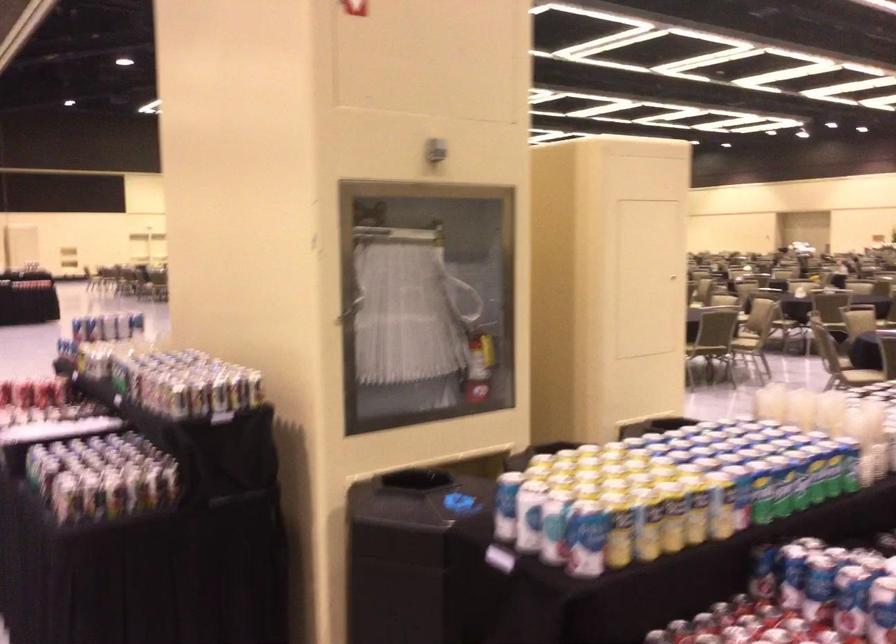
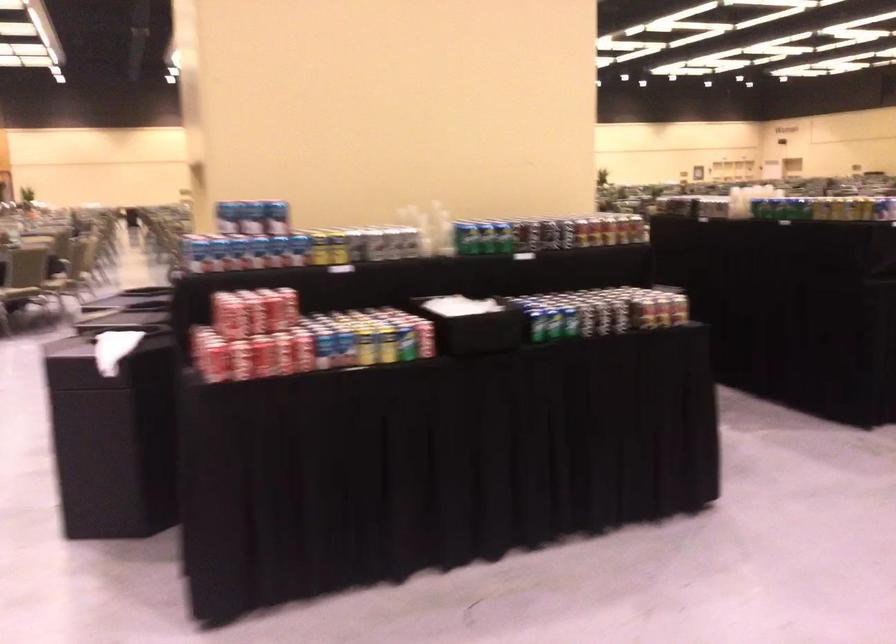
Locate, in the second image, the point that corresponds to pixel 119 341 in the first image.

(352, 245)